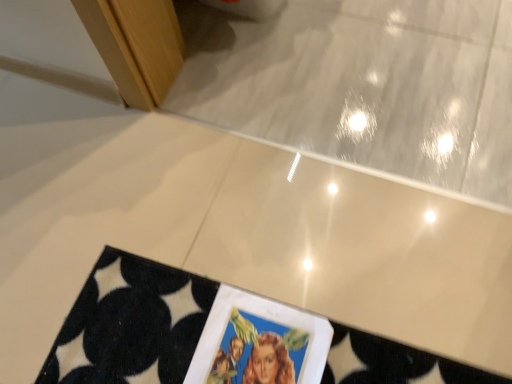
What are the coordinates of `vacant space situated above white glossy tablet at center (from a real-world perspective)` in the screenshot? It's located at (253, 353).